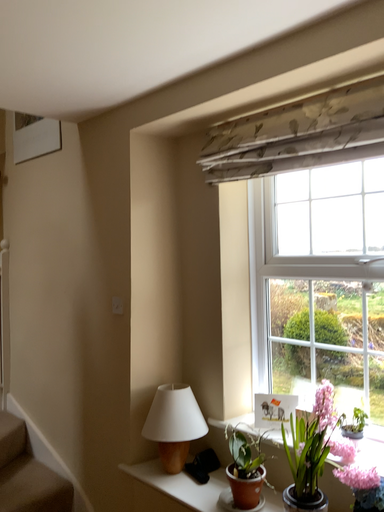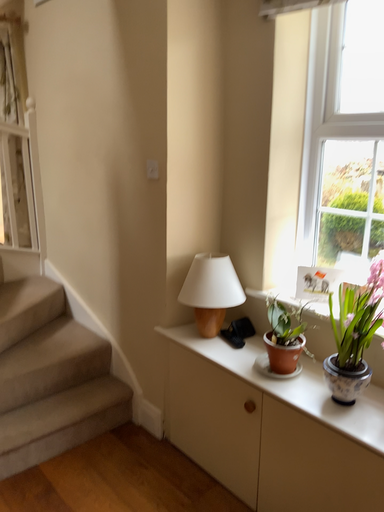
Question: Which way did the camera rotate in the video?

Choices:
 (A) rotated upward
 (B) rotated downward

Answer: (B)